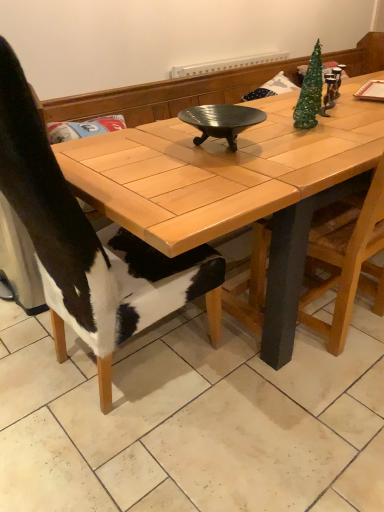
Describe the element at coordinates (237, 188) in the screenshot. The height and width of the screenshot is (512, 384). I see `wooden table at center` at that location.

What is the approximate width of black ribbed metal wok at center?

black ribbed metal wok at center is 12.02 inches wide.

This screenshot has width=384, height=512. Describe the element at coordinates (221, 121) in the screenshot. I see `black ribbed metal wok at center` at that location.

The height and width of the screenshot is (512, 384). Find the location of `wooden table at center`. wooden table at center is located at coordinates (237, 188).

From a real-world perspective, between black ribbed metal wok at center and wooden table at center, who is vertically higher?

black ribbed metal wok at center, from a real-world perspective.

Is black ribbed metal wok at center oriented away from wooden table at center?

That's not correct — black ribbed metal wok at center is not looking away from wooden table at center.

Identify the location of the 2nd chair in front of the black ribbed metal wok at center, counting from the anchor's position. (88, 242).

From a real-world perspective, which object rests below the other?

cowhide at left, marked as the 2th chair in a right-to-left arrangement, from a real-world perspective.

In the scene shown: Considering the sizes of objects black ribbed metal wok at center and cowhide at left, marked as the 2th chair in a right-to-left arrangement, in the image provided, who is shorter, black ribbed metal wok at center or cowhide at left, marked as the 2th chair in a right-to-left arrangement,?

Standing shorter between the two is black ribbed metal wok at center.

From the image's perspective, which object appears higher, black ribbed metal wok at center or cowhide at left, marked as the 2th chair in a right-to-left arrangement?

black ribbed metal wok at center, from the image's perspective.

Would you say wooden table at center is inside or outside black ribbed metal wok at center?

wooden table at center lies outside black ribbed metal wok at center.

Who is smaller, wooden table at center or black ribbed metal wok at center?

black ribbed metal wok at center is smaller.

Locate an element on the screen. This screenshot has width=384, height=512. coffee table that is on the right side of black ribbed metal wok at center is located at coordinates (237, 188).

From their relative heights in the image, would you say wooden table at center is taller or shorter than black ribbed metal wok at center?

In the image, wooden table at center appears to be taller than black ribbed metal wok at center.

From a real-world perspective, does cowhide at left, which ranks as the first chair in left-to-right order, sit lower than black ribbed metal wok at center?

Yes, from a real-world perspective, cowhide at left, which ranks as the first chair in left-to-right order, is below black ribbed metal wok at center.

What are the coordinates of `wok on the right of cowhide at left, which ranks as the first chair in left-to-right order` in the screenshot? It's located at (221, 121).

Visually, is cowhide at left, which ranks as the first chair in left-to-right order, positioned to the left or to the right of black ribbed metal wok at center?

cowhide at left, which ranks as the first chair in left-to-right order, is to the left of black ribbed metal wok at center.

Considering the relative sizes of cowhide at left, which ranks as the first chair in left-to-right order, and black ribbed metal wok at center in the image provided, is cowhide at left, which ranks as the first chair in left-to-right order, taller than black ribbed metal wok at center?

Yes, cowhide at left, which ranks as the first chair in left-to-right order, is taller than black ribbed metal wok at center.

Is wooden chair at right, the 1th chair in the right-to-left sequence, turned away from wooden table at center?

Absolutely, wooden chair at right, the 1th chair in the right-to-left sequence, is directed away from wooden table at center.

How much distance is there between wooden chair at right, which ranks as the second chair in left-to-right order, and wooden table at center?

The distance of wooden chair at right, which ranks as the second chair in left-to-right order, from wooden table at center is 13.33 inches.

Which of these two, wooden chair at right, which ranks as the second chair in left-to-right order, or wooden table at center, stands shorter?

wooden table at center.

Who is smaller, wooden chair at right, the 1th chair in the right-to-left sequence, or wooden table at center?

With smaller size is wooden chair at right, the 1th chair in the right-to-left sequence.

Which is in front, wooden chair at right, the 1th chair in the right-to-left sequence, or cowhide at left, marked as the 2th chair in a right-to-left arrangement?

cowhide at left, marked as the 2th chair in a right-to-left arrangement, is in front.

Can you confirm if wooden chair at right, the 1th chair in the right-to-left sequence, is bigger than cowhide at left, marked as the 2th chair in a right-to-left arrangement?

No, wooden chair at right, the 1th chair in the right-to-left sequence, is not bigger than cowhide at left, marked as the 2th chair in a right-to-left arrangement.

Considering the positions of point (331, 353) and point (156, 313), is point (331, 353) closer or farther from the camera than point (156, 313)?

Point (331, 353) is positioned farther from the camera compared to point (156, 313).

How many degrees apart are the facing directions of wooden chair at right, the 1th chair in the right-to-left sequence, and cowhide at left, which ranks as the first chair in left-to-right order?

There is a 87.8-degree angle between the facing directions of wooden chair at right, the 1th chair in the right-to-left sequence, and cowhide at left, which ranks as the first chair in left-to-right order.

From a real-world perspective, who is located higher, cowhide at left, marked as the 2th chair in a right-to-left arrangement, or wooden chair at right, which ranks as the second chair in left-to-right order?

cowhide at left, marked as the 2th chair in a right-to-left arrangement.

From the image's perspective, is cowhide at left, which ranks as the first chair in left-to-right order, over wooden chair at right, which ranks as the second chair in left-to-right order?

Actually, cowhide at left, which ranks as the first chair in left-to-right order, appears below wooden chair at right, which ranks as the second chair in left-to-right order, in the image.

Between cowhide at left, which ranks as the first chair in left-to-right order, and wooden chair at right, the 1th chair in the right-to-left sequence, which one has larger width?

Wider between the two is cowhide at left, which ranks as the first chair in left-to-right order.

Is cowhide at left, which ranks as the first chair in left-to-right order, oriented away from wooden chair at right, which ranks as the second chair in left-to-right order?

No.

The image size is (384, 512). I want to click on wok on the left of wooden table at center, so click(x=221, y=121).

In order to click on wok behind the cowhide at left, marked as the 2th chair in a right-to-left arrangement in this screenshot , I will do `click(221, 121)`.

From the image, which object appears to be farther from wooden chair at right, which ranks as the second chair in left-to-right order, cowhide at left, which ranks as the first chair in left-to-right order, or wooden table at center?

cowhide at left, which ranks as the first chair in left-to-right order, is positioned further to the anchor wooden chair at right, which ranks as the second chair in left-to-right order.

Considering their positions, is black ribbed metal wok at center positioned closer to wooden chair at right, which ranks as the second chair in left-to-right order, than wooden table at center?

wooden table at center.

Considering their positions, is black ribbed metal wok at center positioned further to wooden table at center than cowhide at left, which ranks as the first chair in left-to-right order?

cowhide at left, which ranks as the first chair in left-to-right order, lies further to wooden table at center than the other object.

Estimate the real-world distances between objects in this image. Which object is closer to wooden chair at right, which ranks as the second chair in left-to-right order, wooden table at center or cowhide at left, which ranks as the first chair in left-to-right order?

wooden table at center is closer to wooden chair at right, which ranks as the second chair in left-to-right order.

Which object lies nearer to the anchor point wooden table at center, black ribbed metal wok at center or wooden chair at right, which ranks as the second chair in left-to-right order?

The object closer to wooden table at center is black ribbed metal wok at center.

Estimate the real-world distances between objects in this image. Which object is further from wooden table at center, cowhide at left, marked as the 2th chair in a right-to-left arrangement, or black ribbed metal wok at center?

The object further to wooden table at center is cowhide at left, marked as the 2th chair in a right-to-left arrangement.

From the image, which object appears to be nearer to wooden table at center, wooden chair at right, the 1th chair in the right-to-left sequence, or black ribbed metal wok at center?

black ribbed metal wok at center.

Considering their positions, is wooden chair at right, which ranks as the second chair in left-to-right order, positioned further to cowhide at left, marked as the 2th chair in a right-to-left arrangement, than wooden table at center?

Based on the image, wooden chair at right, which ranks as the second chair in left-to-right order, appears to be further to cowhide at left, marked as the 2th chair in a right-to-left arrangement.

Locate an element on the screen. Image resolution: width=384 pixels, height=512 pixels. wok between cowhide at left, marked as the 2th chair in a right-to-left arrangement, and wooden chair at right, the 1th chair in the right-to-left sequence, in the horizontal direction is located at coordinates (221, 121).

The image size is (384, 512). In order to click on wok between cowhide at left, which ranks as the first chair in left-to-right order, and wooden table at center in this screenshot , I will do `click(221, 121)`.

Locate an element on the screen. The height and width of the screenshot is (512, 384). chair situated between cowhide at left, which ranks as the first chair in left-to-right order, and wooden table at center from left to right is located at coordinates (346, 258).

Identify the location of chair between black ribbed metal wok at center and wooden table at center from left to right. Image resolution: width=384 pixels, height=512 pixels. (346, 258).